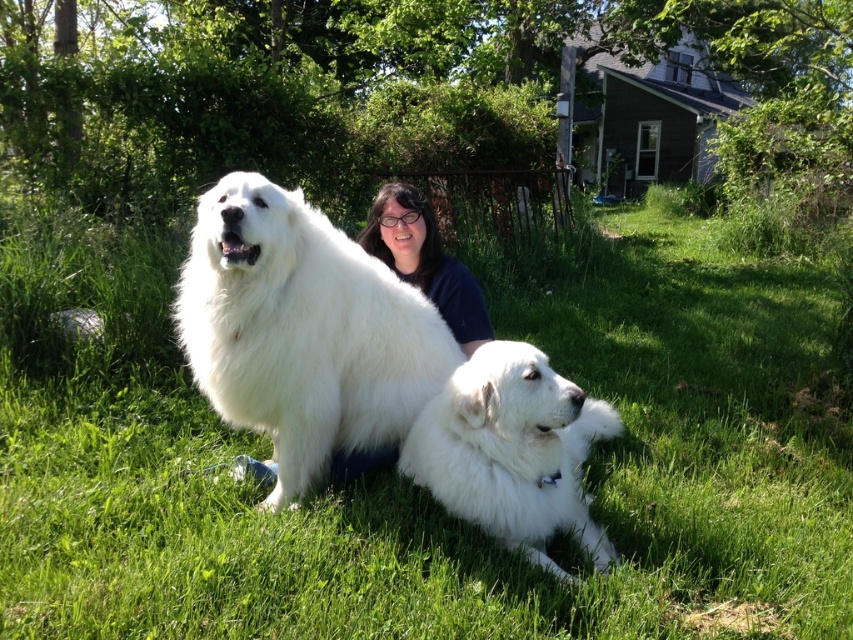
You are trying to take a photo of the green grass at center and the white fluffy dog at center. Which object is smaller in the image?

The green grass at center is smaller than the white fluffy dog at center.